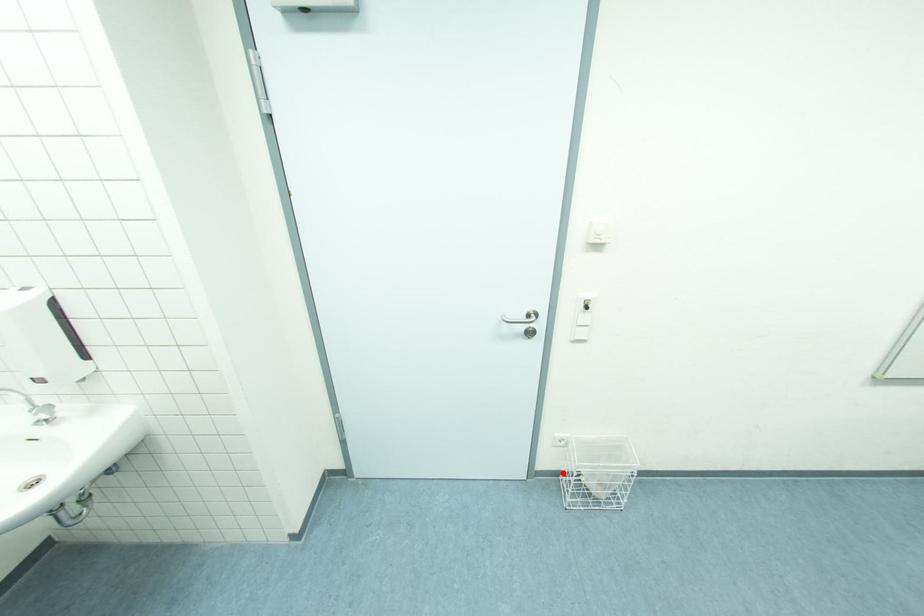
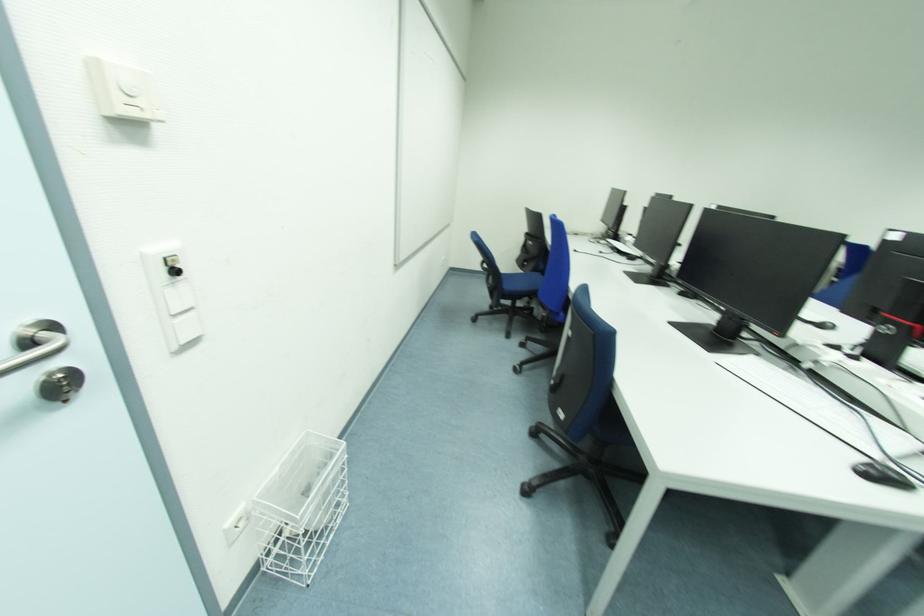
Question: I am providing you with two images of the same scene from different viewpoints. A red point is marked on the first image. Can you still see the location of the red point in image 2?

Choices:
 (A) Yes
 (B) No

Answer: (A)